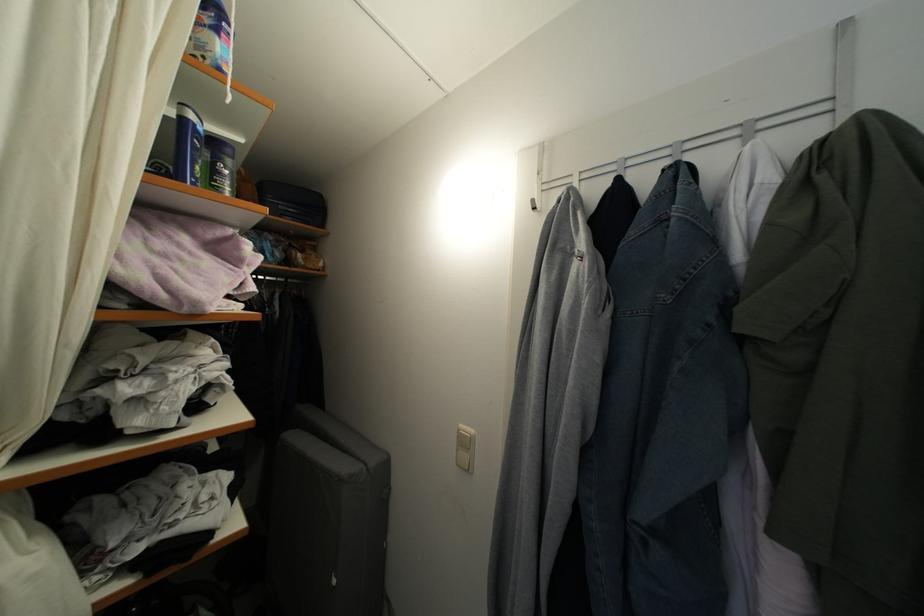
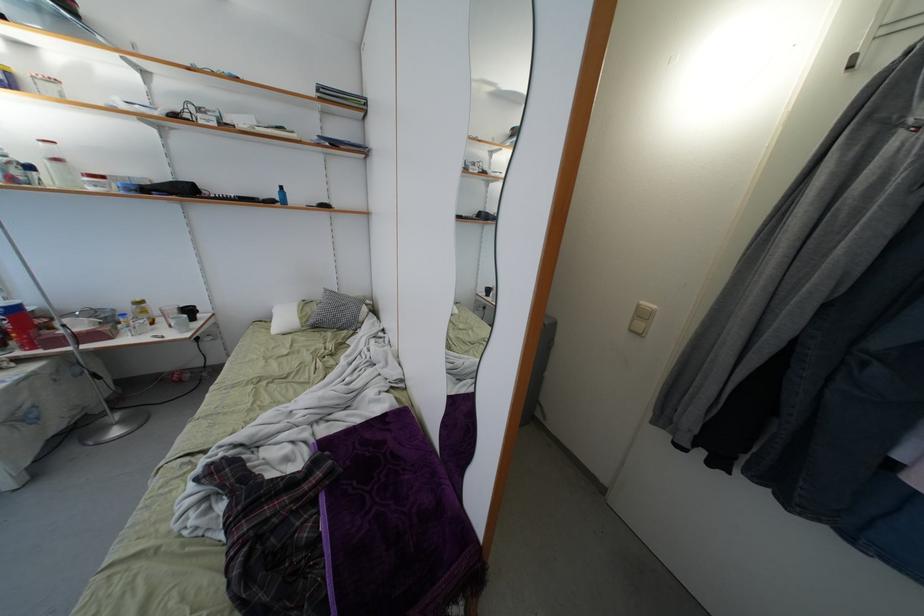
The images are taken continuously from a first-person perspective. In which direction are you moving?

The movement direction of the cameraman is left, backward.